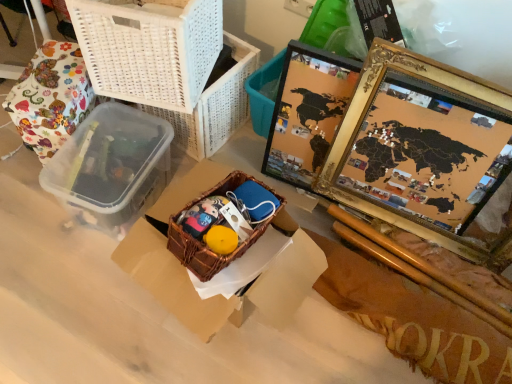
Where is `blank space situated above floral fabric wrapped object at left (from a real-world perspective)`? This screenshot has height=384, width=512. blank space situated above floral fabric wrapped object at left (from a real-world perspective) is located at coordinates (54, 71).